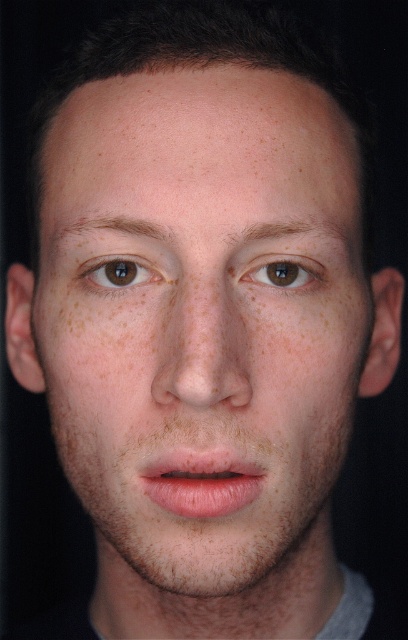
Question: Which of the following is the closest to the observer?

Choices:
 (A) brown matte eye at upper left
 (B) brown matte eye at center

Answer: (B)

Question: Which point is farther to the camera?

Choices:
 (A) (301, 284)
 (B) (102, 394)

Answer: (A)

Question: Is natural skin tone freckled face at center in front of brown matte eye at upper left?

Choices:
 (A) yes
 (B) no

Answer: (A)

Question: Can you confirm if natural skin tone freckled face at center is smaller than brown matte eye at center?

Choices:
 (A) yes
 (B) no

Answer: (B)

Question: Can you confirm if natural skin tone freckled face at center is smaller than brown matte eye at upper left?

Choices:
 (A) yes
 (B) no

Answer: (B)

Question: Which point is farther from the camera taking this photo?

Choices:
 (A) tap(106, 269)
 (B) tap(148, 525)

Answer: (A)